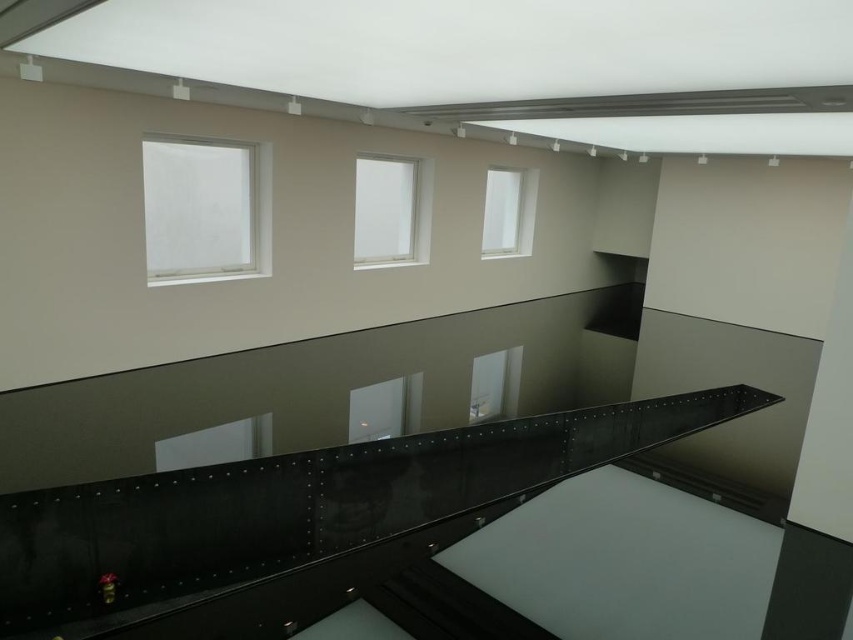
Question: Among these objects, which one is farthest from the camera?

Choices:
 (A) clear glass window at center
 (B) white matte window at upper center
 (C) white matte window at upper left
 (D) glossy metal balustrade at center

Answer: (B)

Question: Can you confirm if glossy metal balustrade at center is positioned to the left of white matte window at upper left?

Choices:
 (A) no
 (B) yes

Answer: (A)

Question: Is the position of white matte window at upper left less distant than that of clear glass window at center?

Choices:
 (A) no
 (B) yes

Answer: (B)

Question: Which point appears closest to the camera in this image?

Choices:
 (A) (486, 211)
 (B) (175, 547)
 (C) (410, 248)

Answer: (B)

Question: Can you confirm if glossy metal balustrade at center is positioned below clear glass window at center?

Choices:
 (A) yes
 (B) no

Answer: (A)

Question: Which point is farther to the camera?

Choices:
 (A) white matte window at upper left
 (B) white matte window at upper center
 (C) glossy metal balustrade at center
 (D) clear glass window at center

Answer: (B)